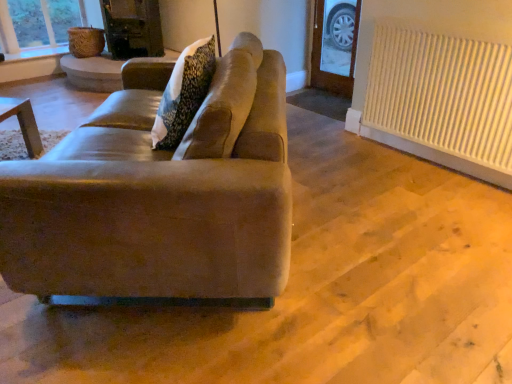
Question: From a real-world perspective, is white ribbed radiator at right above or below suede-like beige couch at center?

Choices:
 (A) below
 (B) above

Answer: (A)

Question: Considering the positions of point (482, 140) and point (169, 269), is point (482, 140) closer or farther from the camera than point (169, 269)?

Choices:
 (A) farther
 (B) closer

Answer: (A)

Question: In terms of height, does white ribbed radiator at right look taller or shorter compared to suede-like beige couch at center?

Choices:
 (A) tall
 (B) short

Answer: (A)

Question: Considering the positions of suede-like beige couch at center and white ribbed radiator at right in the image, is suede-like beige couch at center taller or shorter than white ribbed radiator at right?

Choices:
 (A) tall
 (B) short

Answer: (B)

Question: In terms of width, does suede-like beige couch at center look wider or thinner when compared to white ribbed radiator at right?

Choices:
 (A) thin
 (B) wide

Answer: (B)

Question: Visually, is suede-like beige couch at center positioned to the left or to the right of white ribbed radiator at right?

Choices:
 (A) left
 (B) right

Answer: (A)

Question: From the image's perspective, is suede-like beige couch at center above or below white ribbed radiator at right?

Choices:
 (A) above
 (B) below

Answer: (B)